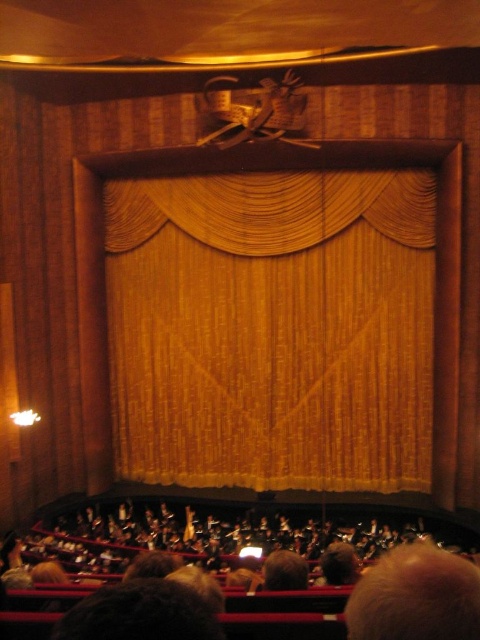
You are sitting in the theater audience and want to see the stage emblem above the curtain. There are two points marked on the floor in front of you. One is at point (148, 198) and the other is at point (319, 557). Which point should you move closer to so that you can see the emblem better?

You should move closer to point 0.873, 0665 because point (148, 198) is behind point (319, 557), meaning it is farther from the stage emblem. Being closer to the front point will provide a better view.

You are sitting in the theater and notice a specific point marked at coordinates [273,328]. Based on the scene description, what object is located at this point?

The point at coordinates [273,328] corresponds to the gold textured curtain at center.